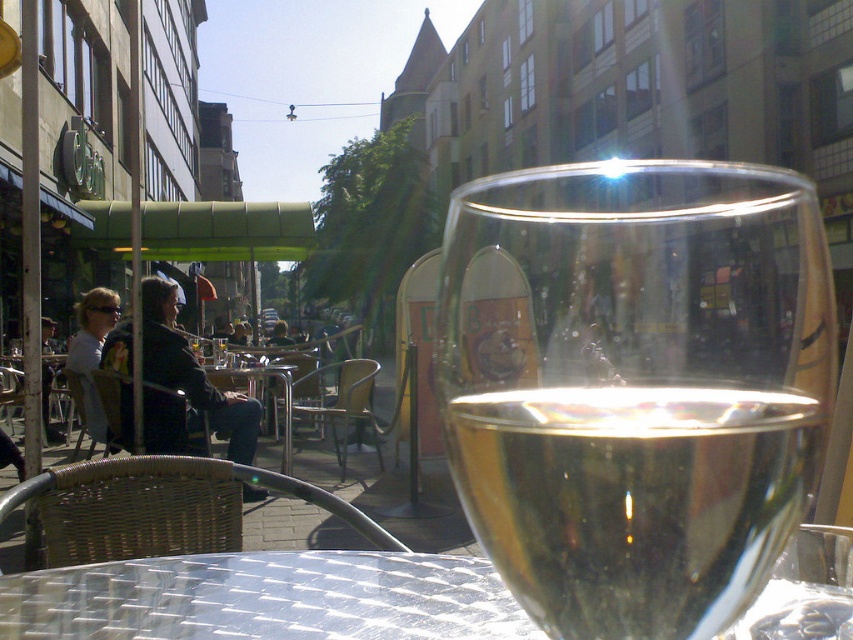
In the scene shown: You are a waiter at the outdoor cafe. You need to place a dessert plate next to the clear glass wine glass at center. Can you fit it there without moving the transparent glass table at center?

The clear glass wine glass at center occupies less space than the transparent glass table at center, so yes, there is enough space to place the dessert plate next to the clear glass wine glass at center without moving the transparent glass table at center.

You are a customer at the outdoor cafe and want to place your sunglasses on the transparent glass table at center. However, you notice the clear glass wine glass at center is in the way. Can you slide the sunglasses from the front of the wine glass to the table without moving the wine glass?

The transparent glass table at center is behind the clear glass wine glass at center, so sliding the sunglasses from the front of the wine glass would require moving them past the wine glass to reach the table. Since the table is behind the glass, you cannot slide the sunglasses directly onto the table without moving the wine glass.

You are a waiter at the outdoor cafe and need to place a new menu on the table without covering the wine glass. Can you fit the menu on the transparent glass table at center next to the clear glass wine glass at center?

The clear glass wine glass at center is taller than the transparent glass table at center. Since the wine glass is taller than the table itself, it might extend beyond the table surface, leaving limited space for placing the menu. Therefore, it might be challenging to place the menu on the transparent glass table at center without covering the wine glass.